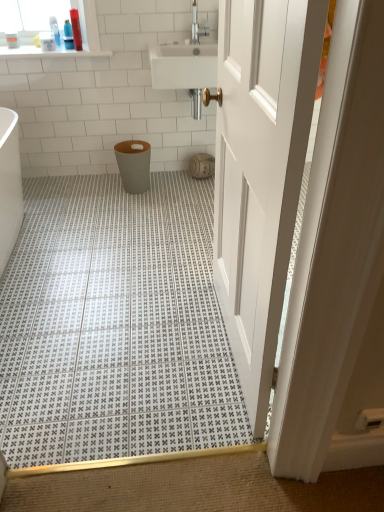
Question: Considering their positions, is white plastic bottle at upper left, acting as the 3th toiletry starting from the right, located in front of or behind matte plastic bottle at upper left, the second toiletry when ordered from left to right?

Choices:
 (A) front
 (B) behind

Answer: (A)

Question: Based on their positions, is white plastic bottle at upper left, acting as the 3th toiletry starting from the right, located to the left or right of matte plastic bottle at upper left, which ranks as the 2th toiletry in right-to-left order?

Choices:
 (A) right
 (B) left

Answer: (B)

Question: Estimate the real-world distances between objects in this image. Which object is closer to the translucent plastic tube at upper left, arranged as the 1th toiletry when viewed from the right?

Choices:
 (A) white glossy countertop at upper left
 (B) matte gray plastic toilet bowl at center
 (C) matte plastic bottle at upper left, the second toiletry when ordered from left to right
 (D) white plastic bottle at upper left, which is the 1th toiletry from left to right
 (E) brushed metal faucet at upper center

Answer: (C)

Question: Which object is the closest to the matte beige toilet paper at center?

Choices:
 (A) matte gray plastic toilet bowl at center
 (B) translucent plastic tube at upper left, the third toiletry positioned from the left
 (C) matte plastic bottle at upper left, which ranks as the 2th toiletry in right-to-left order
 (D) brushed metal faucet at upper center
 (E) white glossy countertop at upper left

Answer: (A)